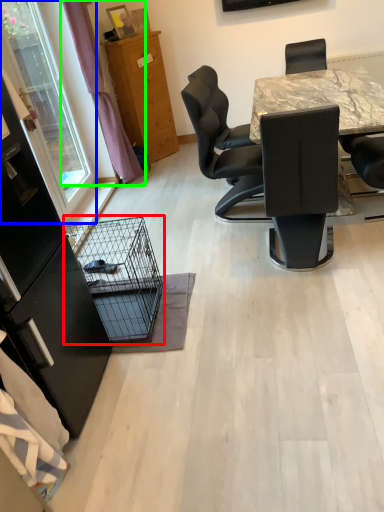
Question: Based on their relative distances, which object is nearer to bird cage (highlighted by a red box)? Choose from window screen (highlighted by a blue box) and curtain (highlighted by a green box).

Choices:
 (A) window screen
 (B) curtain

Answer: (A)